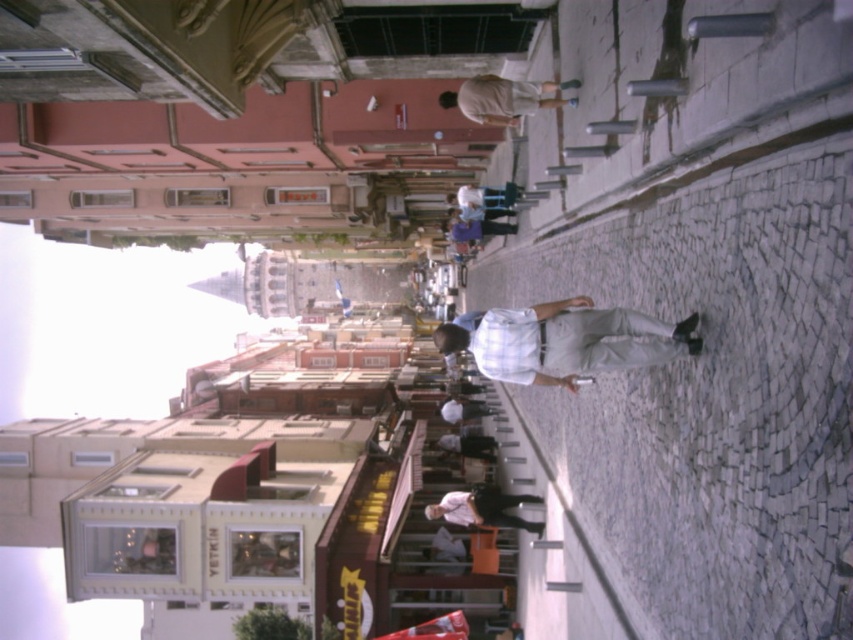
Question: Which of the following is the farthest from the observer?

Choices:
 (A) light brown wooden skateboard at center
 (B) white shirt at center

Answer: (B)

Question: Considering the real-world distances, which object is farthest from the white shirt at center?

Choices:
 (A) light brown wooden skateboard at center
 (B) white plaid shirt at center

Answer: (A)

Question: In this image, where is white plaid shirt at center located relative to white shirt at center?

Choices:
 (A) right
 (B) left

Answer: (A)

Question: Which point is farther from the camera taking this photo?

Choices:
 (A) (474, 493)
 (B) (598, 316)
 (C) (531, 99)

Answer: (A)

Question: Does white plaid shirt at center lie in front of white shirt at center?

Choices:
 (A) yes
 (B) no

Answer: (A)

Question: Is white plaid shirt at center above white shirt at center?

Choices:
 (A) yes
 (B) no

Answer: (A)